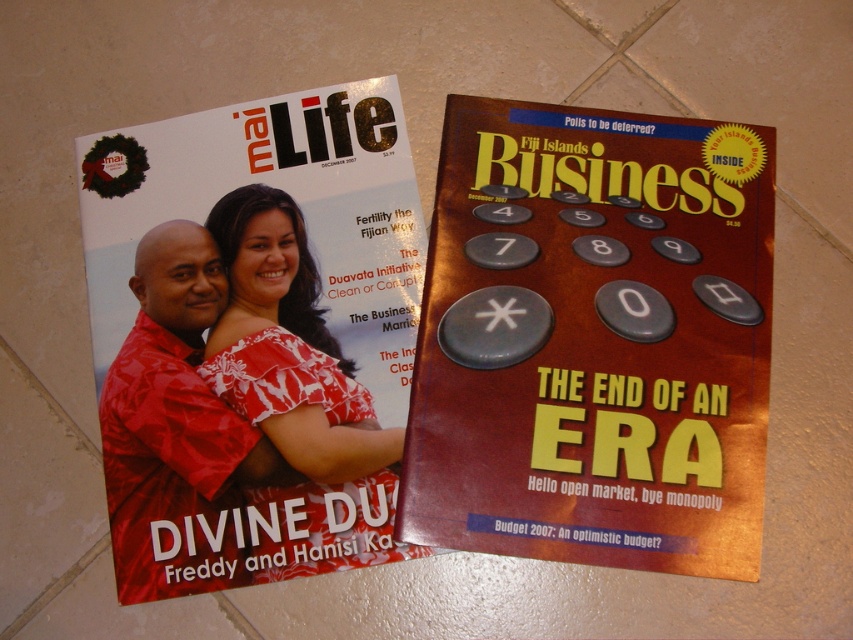
You are organizing a display of magazines and clothing items. You have a matte red magazine at upper left and a white floral dress at center. According to the image, which item is positioned higher up?

The matte red magazine at upper left is positioned higher up than the white floral dress at center because it is above it.

You are standing in a room where the matte red magazine at upper left is placed on a table. You need to pick it up without moving any other objects. Can you reach it from your current position?

The matte red magazine at upper left is 26.76 inches away from the viewer, so yes, you can reach it as the distance is within typical arm reach.